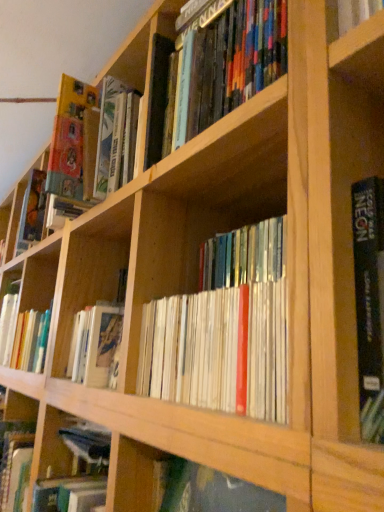
Question: Considering the positions of wooden bookshelf at center and wooden bookshelf at center in the image, is wooden bookshelf at center taller or shorter than wooden bookshelf at center?

Choices:
 (A) short
 (B) tall

Answer: (A)

Question: Relative to wooden bookshelf at center, is wooden bookshelf at center in front or behind?

Choices:
 (A) behind
 (B) front

Answer: (B)

Question: Choose the correct answer: Is wooden bookshelf at center inside wooden bookshelf at center or outside it?

Choices:
 (A) inside
 (B) outside

Answer: (B)

Question: Considering the positions of wooden bookshelf at center and wooden bookshelf at center in the image, is wooden bookshelf at center bigger or smaller than wooden bookshelf at center?

Choices:
 (A) small
 (B) big

Answer: (B)

Question: In the image, is wooden bookshelf at center positioned in front of or behind wooden bookshelf at center?

Choices:
 (A) front
 (B) behind

Answer: (B)

Question: Is wooden bookshelf at center taller or shorter than wooden bookshelf at center?

Choices:
 (A) tall
 (B) short

Answer: (A)

Question: In the image, is wooden bookshelf at center on the left side or the right side of wooden bookshelf at center?

Choices:
 (A) right
 (B) left

Answer: (B)